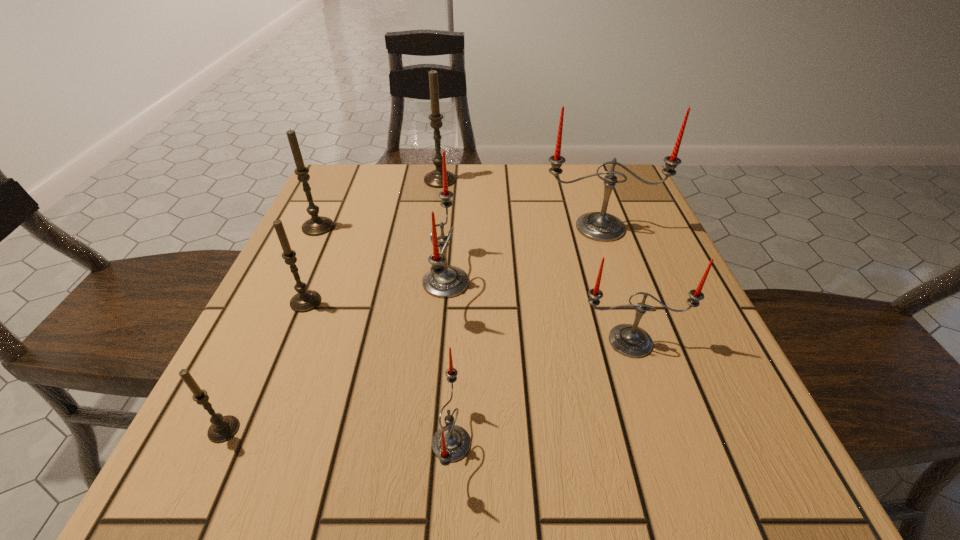
Locate an element on the screen. the biggest gray candle is located at coordinates (434, 178).

Locate an element on the screen. Image resolution: width=960 pixels, height=540 pixels. the farthest gray candle is located at coordinates (434, 178).

Find the location of `the farthest red candle`. the farthest red candle is located at coordinates (599, 226).

Identify the location of the third smallest gray candle. (317, 225).

Identify the location of the second biggest red candle. (444, 281).

Locate an element on the screen. The height and width of the screenshot is (540, 960). the second nearest red candle is located at coordinates (629, 340).

The width and height of the screenshot is (960, 540). I want to click on the third nearest object, so click(x=629, y=340).

The image size is (960, 540). Identify the location of the second nearest gray candle. pos(305,300).

Image resolution: width=960 pixels, height=540 pixels. I want to click on the smallest gray candle, so (x=223, y=428).

Locate an element on the screen. The height and width of the screenshot is (540, 960). the smallest red candle is located at coordinates (451, 443).